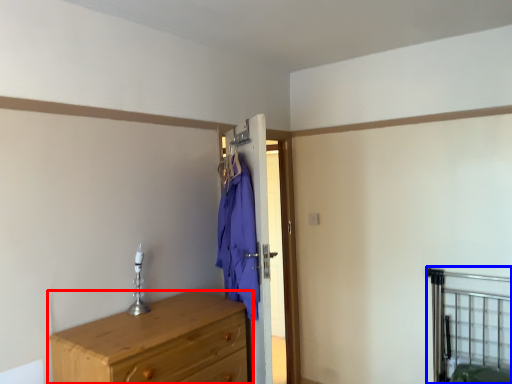
Question: Which object is further to the camera taking this photo, chest of drawers (highlighted by a red box) or bed frame (highlighted by a blue box)?

Choices:
 (A) chest of drawers
 (B) bed frame

Answer: (B)